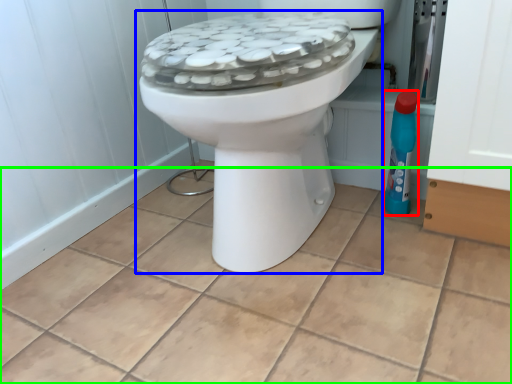
Question: Estimate the real-world distances between objects in this image. Which object is closer to cleaning product (highlighted by a red box), toilet (highlighted by a blue box) or ceramic tile (highlighted by a green box)?

Choices:
 (A) toilet
 (B) ceramic tile

Answer: (A)